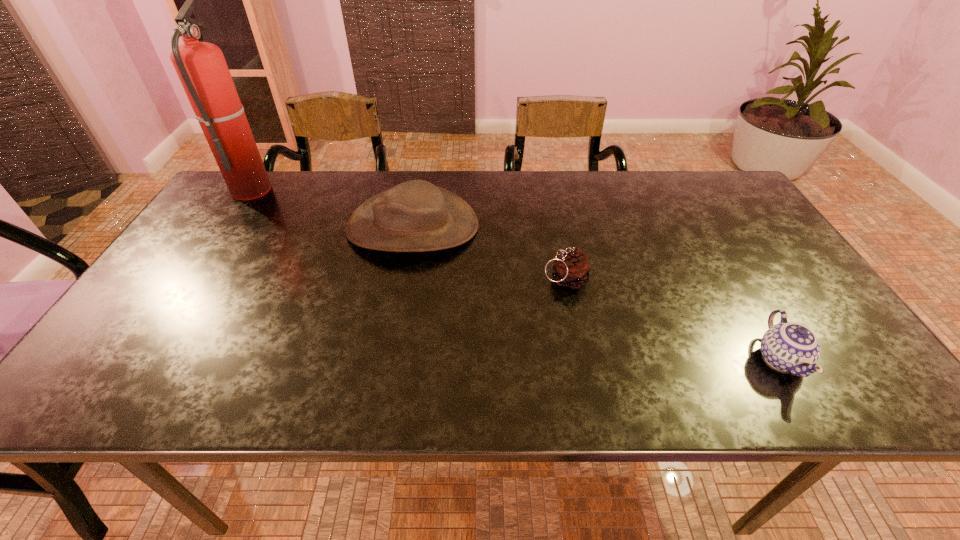
Image resolution: width=960 pixels, height=540 pixels. I want to click on the leftmost object, so click(201, 67).

This screenshot has width=960, height=540. Identify the location of fire extinguisher. (201, 67).

You are a GUI agent. You are given a task and a screenshot of the screen. Output one action in this format:
    pyautogui.click(x=<x>, y=<y>)
    Task: Click on the third object from right to left
    The height and width of the screenshot is (540, 960).
    Given the screenshot: What is the action you would take?
    pyautogui.click(x=415, y=216)

The image size is (960, 540). Find the location of `the second nearest object`. the second nearest object is located at coordinates (572, 268).

Locate an element on the screen. This screenshot has height=540, width=960. the third object from left to right is located at coordinates (572, 268).

Image resolution: width=960 pixels, height=540 pixels. In order to click on chinaware in this screenshot , I will do 790,347.

Identify the location of the rightmost object. Image resolution: width=960 pixels, height=540 pixels. (790, 347).

You are a GUI agent. You are given a task and a screenshot of the screen. Output one action in this format:
    pyautogui.click(x=<x>, y=<y>)
    Task: Click on the free region located 0.140m with the nozzle and gauge on the tallest object
    
    Given the screenshot: What is the action you would take?
    pyautogui.click(x=316, y=188)

Identify the location of blank area located on the back of the cowboy hat. (422, 172).

You are a GUI agent. You are given a task and a screenshot of the screen. Output one action in this format:
    pyautogui.click(x=<x>, y=<y>)
    Task: Click on the vacant space situated 0.230m with a leaf charm attached to the third farthest object
    Image resolution: width=960 pixels, height=540 pixels.
    Given the screenshot: What is the action you would take?
    pyautogui.click(x=449, y=280)